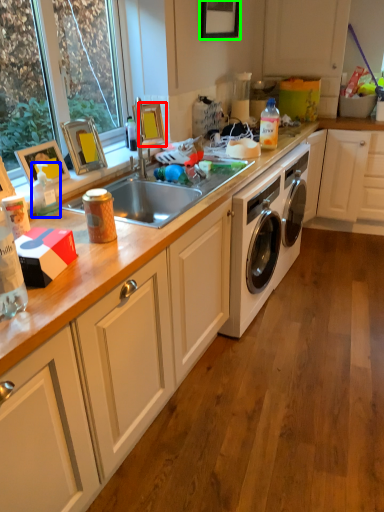
Question: Estimate the real-world distances between objects in this image. Which object is farther from picture frame (highlighted by a red box), bottle (highlighted by a blue box) or picture frame (highlighted by a green box)?

Choices:
 (A) bottle
 (B) picture frame

Answer: (A)